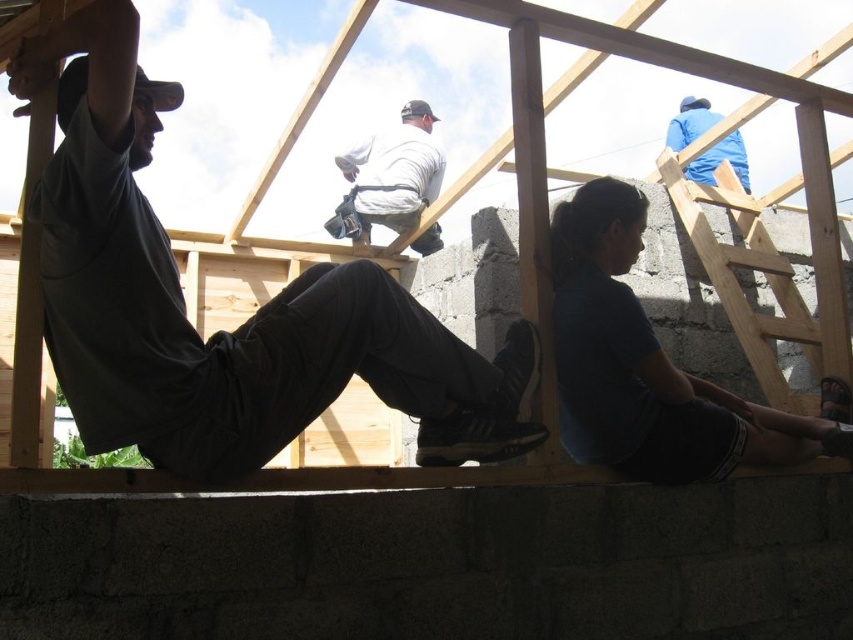
What do you see at coordinates (392, 173) in the screenshot?
I see `white matte shirt at center` at bounding box center [392, 173].

Based on the photo, how far apart are white matte shirt at center and blue fabric jacket at upper right?

They are 6.99 feet apart.

Is point (357, 156) positioned before point (706, 108)?

That is True.

I want to click on white matte shirt at center, so click(x=392, y=173).

Which of these two, blue fabric at lower right or blue fabric jacket at upper right, stands shorter?

With less height is blue fabric jacket at upper right.

Between point (843, 387) and point (683, 100), which one is positioned behind?

The point (683, 100) is more distant.

This screenshot has width=853, height=640. I want to click on blue fabric at lower right, so click(x=653, y=365).

Who is positioned more to the left, dark gray shirt at upper left or white matte shirt at center?

dark gray shirt at upper left is more to the left.

Can you confirm if dark gray shirt at upper left is bigger than white matte shirt at center?

Indeed, dark gray shirt at upper left has a larger size compared to white matte shirt at center.

Who is more distant from viewer, (57, 35) or (399, 113)?

Positioned behind is point (399, 113).

At what (x,y) coordinates should I click in order to perform the action: click on dark gray shirt at upper left. Please return your answer as a coordinate pair (x, y). Looking at the image, I should click on (223, 330).